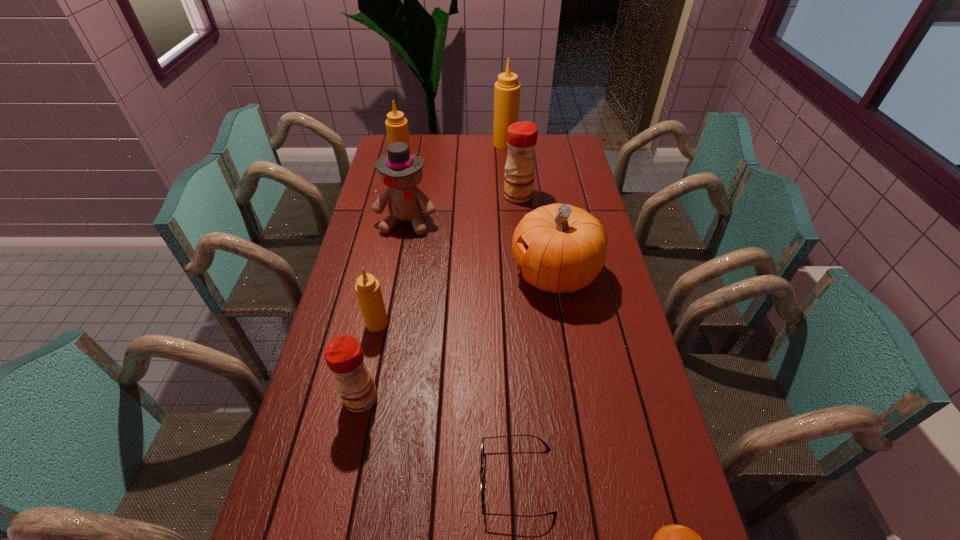
Where is `vacant space situated on the front-facing side of the orange pumpkin`? vacant space situated on the front-facing side of the orange pumpkin is located at coordinates (462, 274).

Image resolution: width=960 pixels, height=540 pixels. In order to click on free spot located 0.250m on the front-facing side of the orange pumpkin in this screenshot , I will do `click(434, 274)`.

Find the location of `free space located 0.390m on the right of the nearest tan condiment`. free space located 0.390m on the right of the nearest tan condiment is located at coordinates (521, 323).

Identify the location of vacant region located on the front of the nearest condiment. The width and height of the screenshot is (960, 540). (344, 480).

The image size is (960, 540). Find the location of `vacant area located 0.260m on the front-facing side of the spectacles`. vacant area located 0.260m on the front-facing side of the spectacles is located at coordinates (363, 480).

This screenshot has width=960, height=540. I want to click on vacant space located on the front-facing side of the spectacles, so click(390, 480).

Find the location of a particular element. The width and height of the screenshot is (960, 540). blank space located 0.390m on the front-facing side of the spectacles is located at coordinates (305, 480).

The width and height of the screenshot is (960, 540). I want to click on object present at the far edge, so click(x=507, y=89).

Where is `rag_doll located in the left edge section of the desktop`? The height and width of the screenshot is (540, 960). rag_doll located in the left edge section of the desktop is located at coordinates (401, 172).

Identify the location of object situated at the right edge. point(564,248).